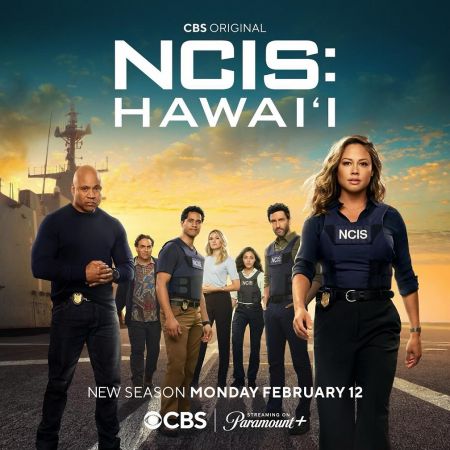
Where is `succulent`? succulent is located at coordinates (346, 329), (348, 241).